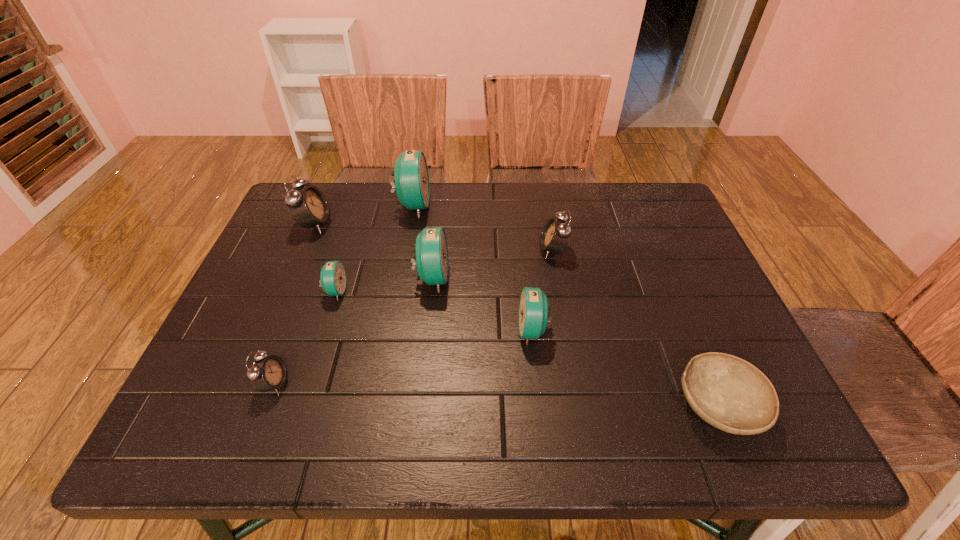
You are a GUI agent. You are given a task and a screenshot of the screen. Output one action in this format:
    pyautogui.click(x=<x>, y=<y>)
    Task: Click on the biggest blue alarm clock
    
    Given the screenshot: What is the action you would take?
    (x=411, y=179)

Find the location of a particular element. the tallest object is located at coordinates 411,179.

You are a GUI agent. You are given a task and a screenshot of the screen. Output one action in this format:
    pyautogui.click(x=<x>, y=<y>)
    Task: Click on the farthest white alarm clock
    This screenshot has width=960, height=540.
    Given the screenshot: What is the action you would take?
    pyautogui.click(x=308, y=206)

Where is `the second biggest blue alarm clock`? The image size is (960, 540). the second biggest blue alarm clock is located at coordinates (431, 251).

Find the location of a particular element. The width and height of the screenshot is (960, 540). the second object from right to left is located at coordinates (555, 235).

Image resolution: width=960 pixels, height=540 pixels. Find the location of `the second smallest white alarm clock`. the second smallest white alarm clock is located at coordinates (555, 235).

This screenshot has width=960, height=540. Find the location of `the sixth farthest object`. the sixth farthest object is located at coordinates (533, 307).

Locate an element on the screen. This screenshot has height=540, width=960. the nearest blue alarm clock is located at coordinates (533, 307).

At what (x,y) coordinates should I click in order to perform the action: click on the third object from left to right. Please return your answer as a coordinate pair (x, y). The width and height of the screenshot is (960, 540). Looking at the image, I should click on (333, 280).

In order to click on the third alarm clock from left to right in this screenshot , I will do `click(333, 280)`.